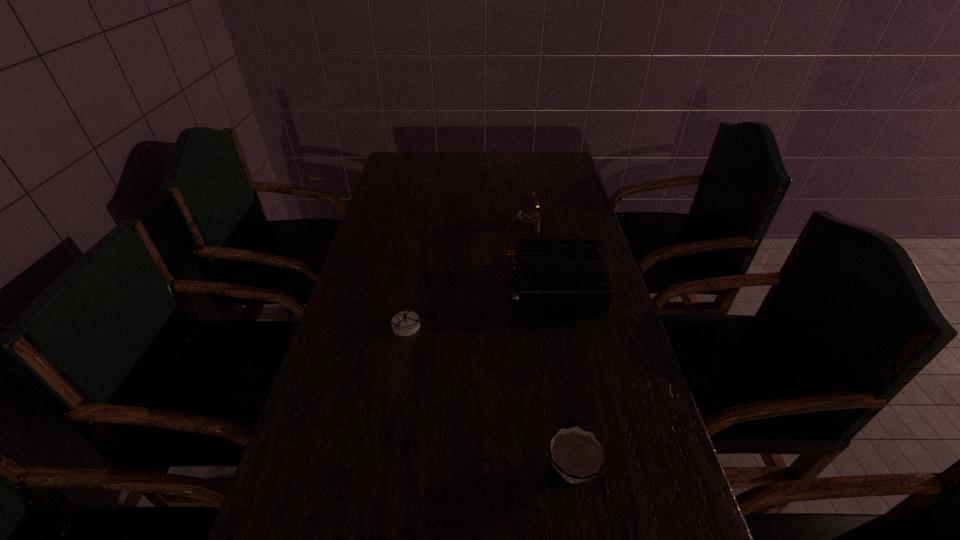
You are a GUI agent. You are given a task and a screenshot of the screen. Output one action in this format:
    pyautogui.click(x=<x>, y=<y>)
    Task: Click on the free area in between the shortest object and the router
    Image resolution: width=960 pixels, height=540 pixels.
    Given the screenshot: What is the action you would take?
    pyautogui.click(x=481, y=306)

Locate an element on the screen. This screenshot has width=960, height=540. object that is the third closest to the farther compass is located at coordinates (578, 456).

Identify which object is the third closest to the right compass. Please provide its 2D coordinates. Your answer should be formatted as a tuple, i.e. [(x, y)], where the tuple contains the x and y coordinates of a point satisfying the conditions above.

[(578, 456)]

Choose which compass is the second nearest neighbor to the router. Please provide its 2D coordinates. Your answer should be formatted as a tuple, i.e. [(x, y)], where the tuple contains the x and y coordinates of a point satisfying the conditions above.

[(405, 323)]

You are a GUI agent. You are given a task and a screenshot of the screen. Output one action in this format:
    pyautogui.click(x=<x>, y=<y>)
    Task: Click on the compass that is the closest to the router
    The width and height of the screenshot is (960, 540).
    Given the screenshot: What is the action you would take?
    pyautogui.click(x=528, y=218)

This screenshot has width=960, height=540. What are the coordinates of `vacant area in the image that satisfies the following two spatial constraints: 1. on the side of the cup with the handle; 2. with the dial facing the farthest object` in the screenshot? It's located at (532, 221).

You are a GUI agent. You are given a task and a screenshot of the screen. Output one action in this format:
    pyautogui.click(x=<x>, y=<y>)
    Task: Click on the blank area in the image that satisfies the following two spatial constraints: 1. on the side of the nearest object with the handle; 2. with the dial facing the taller compass
    
    Given the screenshot: What is the action you would take?
    pyautogui.click(x=532, y=221)

Find the location of a particular element. The image size is (960, 540). free region that satisfies the following two spatial constraints: 1. with the dial facing the farthest object; 2. on the side of the nearest object with the handle is located at coordinates (563, 465).